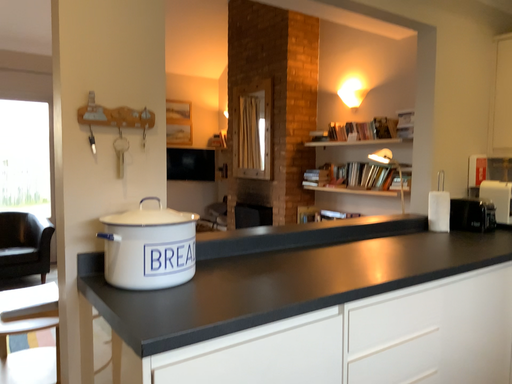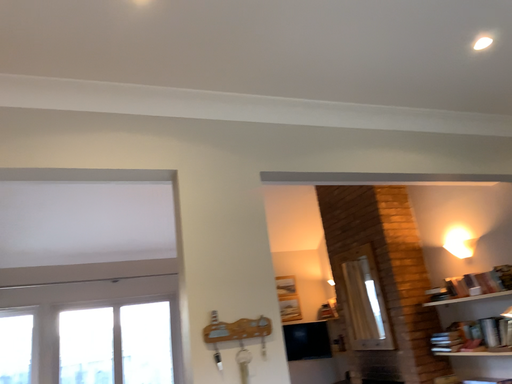
Question: Which way did the camera rotate in the video?

Choices:
 (A) rotated upward
 (B) rotated downward

Answer: (A)